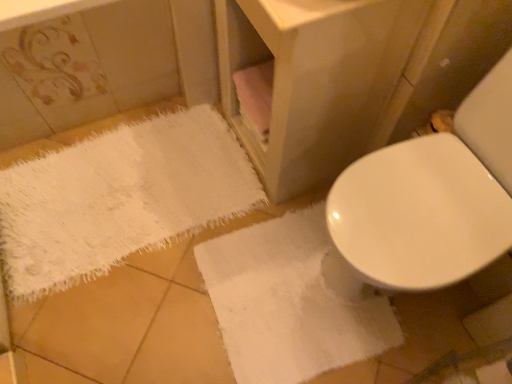
Locate an element on the screen. This screenshot has height=384, width=512. white fluffy bath towel at lower right, which is the second bath towel in left-to-right order is located at coordinates (292, 301).

Measure the distance between point (222, 86) and camera.

The distance of point (222, 86) from camera is 1.48 meters.

Find the location of `white fluffy bath towel at lower right, the first bath towel positioned from the right`. white fluffy bath towel at lower right, the first bath towel positioned from the right is located at coordinates (292, 301).

How far apart are white fluffy bath towel at lower left, the 2th bath towel when ordered from right to left, and matte wood vanity at center?

white fluffy bath towel at lower left, the 2th bath towel when ordered from right to left, and matte wood vanity at center are 18.28 inches apart.

From the image's perspective, is white fluffy bath towel at lower left, the first bath towel positioned from the left, on top of matte wood vanity at center?

No.

Considering the sizes of white fluffy bath towel at lower left, the 2th bath towel when ordered from right to left, and matte wood vanity at center in the image, is white fluffy bath towel at lower left, the 2th bath towel when ordered from right to left, wider or thinner than matte wood vanity at center?

Considering their sizes, white fluffy bath towel at lower left, the 2th bath towel when ordered from right to left, looks broader than matte wood vanity at center.

From a real-world perspective, between white fluffy bath towel at lower left, the first bath towel positioned from the left, and matte wood vanity at center, who is vertically lower?

In real-world perspective, white fluffy bath towel at lower left, the first bath towel positioned from the left, is lower.

Considering the sizes of matte wood vanity at center and white fluffy bath towel at lower right, which is the second bath towel in left-to-right order, in the image, is matte wood vanity at center wider or thinner than white fluffy bath towel at lower right, which is the second bath towel in left-to-right order,?

Considering their sizes, matte wood vanity at center looks slimmer than white fluffy bath towel at lower right, which is the second bath towel in left-to-right order.

Is matte wood vanity at center taller than white fluffy bath towel at lower right, the first bath towel positioned from the right?

Yes.

Choose the correct answer: Is matte wood vanity at center inside white fluffy bath towel at lower right, the first bath towel positioned from the right, or outside it?

matte wood vanity at center is located beyond the bounds of white fluffy bath towel at lower right, the first bath towel positioned from the right.

Which of these two, matte wood vanity at center or white fluffy bath towel at lower right, the first bath towel positioned from the right, is smaller?

white fluffy bath towel at lower right, the first bath towel positioned from the right, is smaller.

From the image's perspective, is matte wood vanity at center below white fluffy bath towel at lower left, the first bath towel positioned from the left?

No.

Identify the location of the 1st bath towel below when counting from the matte wood vanity at center (from the image's perspective). The height and width of the screenshot is (384, 512). (119, 198).

From the picture: Considering the positions of objects matte wood vanity at center and white fluffy bath towel at lower left, the first bath towel positioned from the left, in the image provided, who is in front, matte wood vanity at center or white fluffy bath towel at lower left, the first bath towel positioned from the left,?

matte wood vanity at center is in front.

The image size is (512, 384). I want to click on bath towel below the white fluffy bath towel at lower right, the first bath towel positioned from the right (from a real-world perspective), so click(x=119, y=198).

Which is correct: white fluffy bath towel at lower left, the 2th bath towel when ordered from right to left, is inside white fluffy bath towel at lower right, which is the second bath towel in left-to-right order, or outside of it?

white fluffy bath towel at lower left, the 2th bath towel when ordered from right to left, is not inside white fluffy bath towel at lower right, which is the second bath towel in left-to-right order, it's outside.

Which is more to the left, white fluffy bath towel at lower left, the first bath towel positioned from the left, or white fluffy bath towel at lower right, the first bath towel positioned from the right?

Positioned to the left is white fluffy bath towel at lower left, the first bath towel positioned from the left.

Who is taller, white fluffy bath towel at lower left, the first bath towel positioned from the left, or white fluffy bath towel at lower right, the first bath towel positioned from the right?

white fluffy bath towel at lower left, the first bath towel positioned from the left.

Does white fluffy bath towel at lower right, which is the second bath towel in left-to-right order, have a smaller size compared to matte wood vanity at center?

Yes, white fluffy bath towel at lower right, which is the second bath towel in left-to-right order, is smaller than matte wood vanity at center.

Is white fluffy bath towel at lower right, which is the second bath towel in left-to-right order, facing towards matte wood vanity at center?

No.

Can you confirm if white fluffy bath towel at lower right, which is the second bath towel in left-to-right order, is wider than matte wood vanity at center?

Indeed, white fluffy bath towel at lower right, which is the second bath towel in left-to-right order, has a greater width compared to matte wood vanity at center.

Is there a large distance between white fluffy bath towel at lower right, which is the second bath towel in left-to-right order, and matte wood vanity at center?

No, white fluffy bath towel at lower right, which is the second bath towel in left-to-right order, is not far from matte wood vanity at center.

From a real-world perspective, is white fluffy bath towel at lower right, the first bath towel positioned from the right, physically below white fluffy bath towel at lower left, the 2th bath towel when ordered from right to left?

No.

Is white fluffy bath towel at lower right, the first bath towel positioned from the right, oriented towards white fluffy bath towel at lower left, the 2th bath towel when ordered from right to left?

No.

Is white fluffy bath towel at lower right, which is the second bath towel in left-to-right order, inside the boundaries of white fluffy bath towel at lower left, the 2th bath towel when ordered from right to left, or outside?

white fluffy bath towel at lower right, which is the second bath towel in left-to-right order, is spatially situated outside white fluffy bath towel at lower left, the 2th bath towel when ordered from right to left.

Considering the points (301, 357) and (113, 218), which point is in front, point (301, 357) or point (113, 218)?

The point (301, 357) is closer to the camera.

Locate an element on the screen. Image resolution: width=512 pixels, height=384 pixels. the 2nd bath towel below the matte wood vanity at center (from a real-world perspective) is located at coordinates (119, 198).

Image resolution: width=512 pixels, height=384 pixels. In order to click on bath towel that appears on the right of matte wood vanity at center in this screenshot , I will do `click(292, 301)`.

Looking at this image, estimate the real-world distances between objects in this image. Which object is further from white fluffy bath towel at lower left, the first bath towel positioned from the left, white fluffy bath towel at lower right, which is the second bath towel in left-to-right order, or matte wood vanity at center?

matte wood vanity at center is positioned further to the anchor white fluffy bath towel at lower left, the first bath towel positioned from the left.

From the image, which object appears to be nearer to matte wood vanity at center, white fluffy bath towel at lower left, the 2th bath towel when ordered from right to left, or white fluffy bath towel at lower right, which is the second bath towel in left-to-right order?

white fluffy bath towel at lower right, which is the second bath towel in left-to-right order, is closer to matte wood vanity at center.

Based on their spatial positions, is matte wood vanity at center or white fluffy bath towel at lower right, the first bath towel positioned from the right, further from white fluffy bath towel at lower left, the first bath towel positioned from the left?

matte wood vanity at center lies further to white fluffy bath towel at lower left, the first bath towel positioned from the left, than the other object.

Looking at the image, which one is located closer to white fluffy bath towel at lower right, which is the second bath towel in left-to-right order, white fluffy bath towel at lower left, the 2th bath towel when ordered from right to left, or matte wood vanity at center?

The object closer to white fluffy bath towel at lower right, which is the second bath towel in left-to-right order, is white fluffy bath towel at lower left, the 2th bath towel when ordered from right to left.

Looking at the image, which one is located closer to matte wood vanity at center, white fluffy bath towel at lower right, the first bath towel positioned from the right, or white fluffy bath towel at lower left, the first bath towel positioned from the left?

white fluffy bath towel at lower right, the first bath towel positioned from the right.

Looking at the image, which one is located further to white fluffy bath towel at lower right, the first bath towel positioned from the right, matte wood vanity at center or white fluffy bath towel at lower left, the 2th bath towel when ordered from right to left?

Among the two, matte wood vanity at center is located further to white fluffy bath towel at lower right, the first bath towel positioned from the right.

Where is `bath towel between matte wood vanity at center and white fluffy bath towel at lower right, which is the second bath towel in left-to-right order, in the vertical direction`? The image size is (512, 384). bath towel between matte wood vanity at center and white fluffy bath towel at lower right, which is the second bath towel in left-to-right order, in the vertical direction is located at coordinates (119, 198).